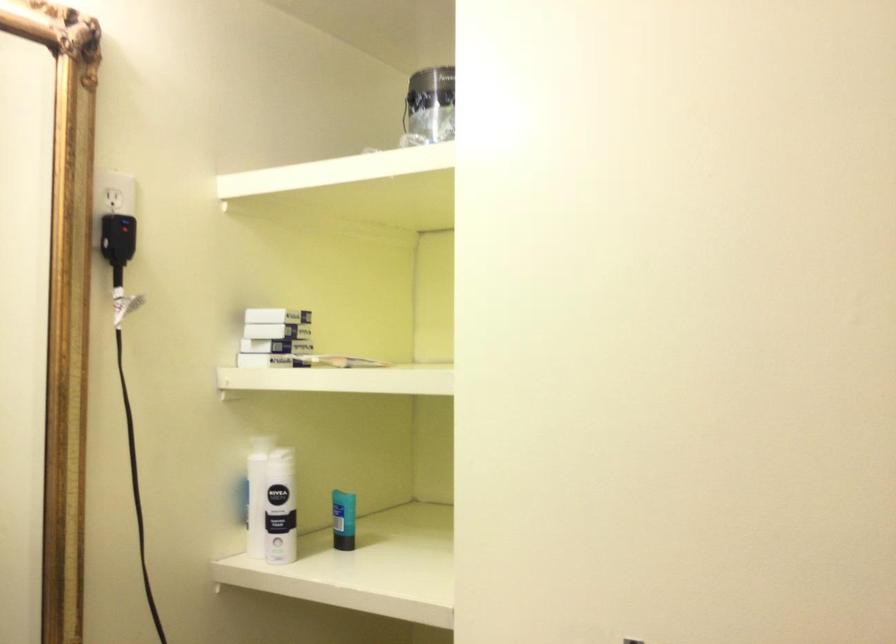
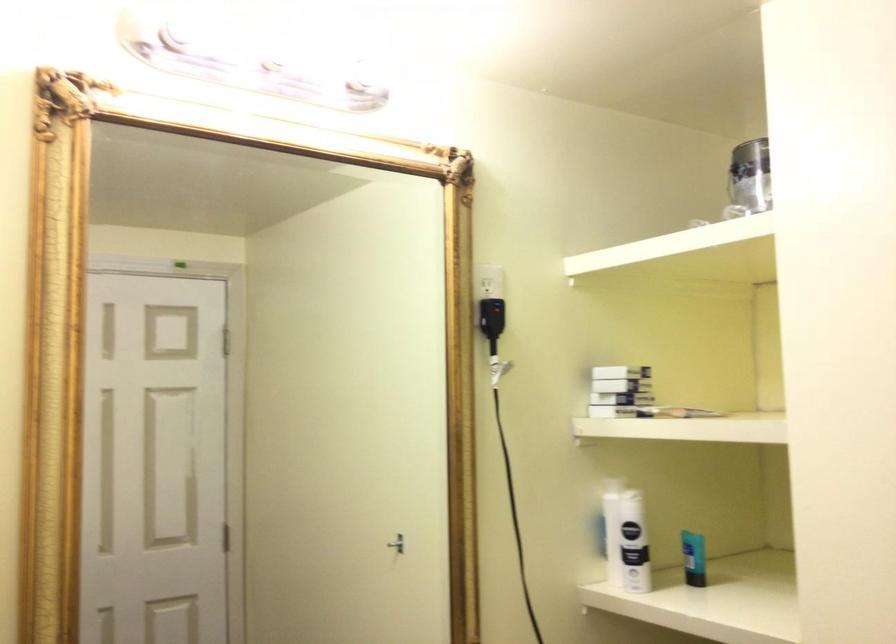
Where in the second image is the point corresponding to the point at 337,520 from the first image?

(693, 558)